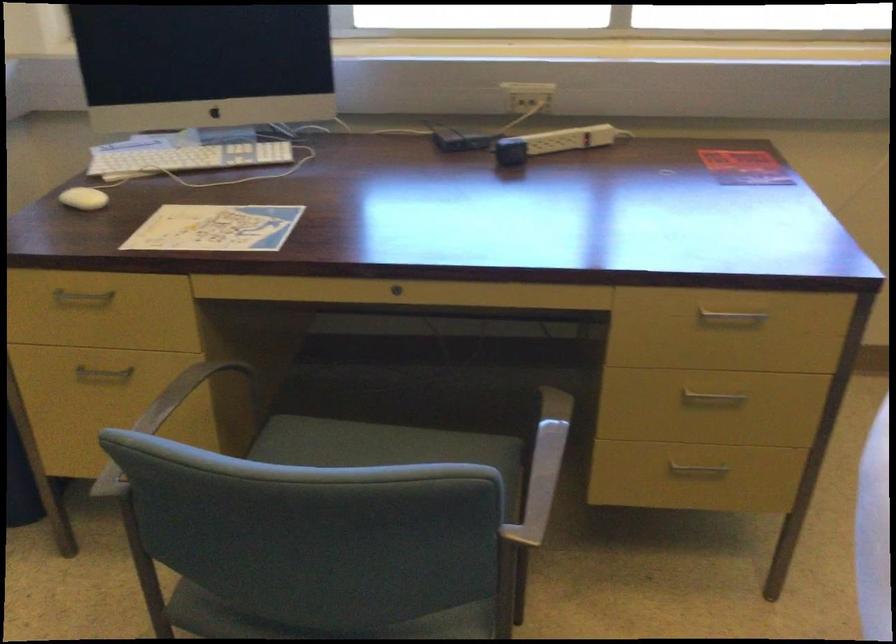
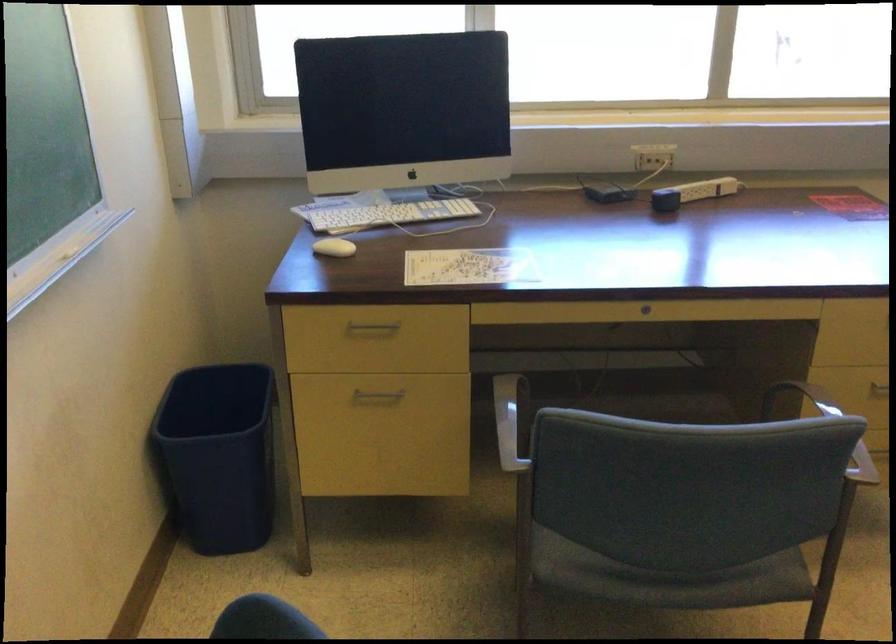
Question: I am providing you with two images of the same scene from different viewpoints. Which of the following objects are not visible in image2?

Choices:
 (A) chair armrest
 (B) wall outlet
 (C) white power strip
 (D) none of these

Answer: (D)